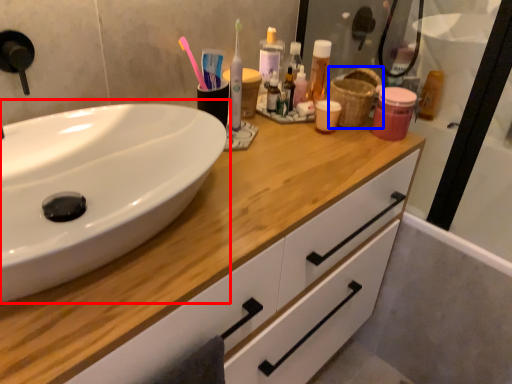
Question: Among these objects, which one is farthest to the camera, sink (highlighted by a red box) or basket (highlighted by a blue box)?

Choices:
 (A) sink
 (B) basket

Answer: (B)